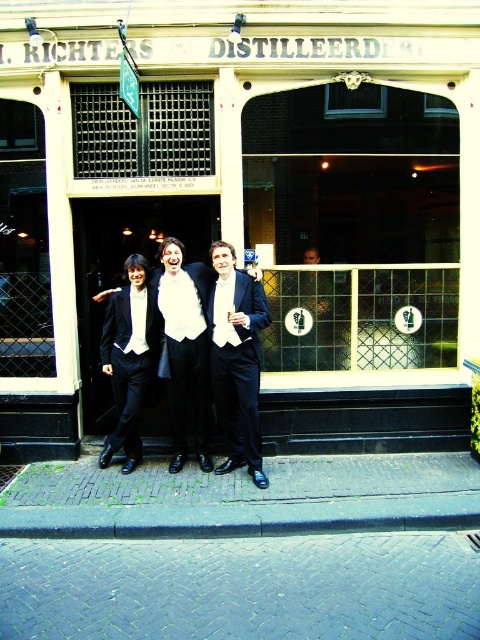
You are a photographer trying to capture a group photo of the three individuals. You need to ensure that the matte black glass at center and the matte black suit at center are in focus simultaneously. Given that your camera has a depth of field that can cover 1.5 meters, will you be able to achieve this?

The distance between the matte black glass at center and the matte black suit at center is 1.66 meters. Since the camera can only cover 1.5 meters, you won need to adjust your settings or position to ensure both are within the depth of field range.

You are a photographer trying to position two subjects wearing black suits for a photo shoot. You observe the shiny black suit at center and the matte black suit at center in the scene. Which subject should you ask to stand on a lower platform to ensure both appear the same height in the final image?

The shiny black suit at center has a greater height compared to matte black suit at center, so you should ask the person wearing the matte black suit at center to stand on a lower platform to balance their heights.

You are a photographer taking a group photo of the shiny black suit at center and the black satin suit at center. Which one is closer to the camera?

The shiny black suit at center is closer to the camera because it is in front of the black satin suit at center.